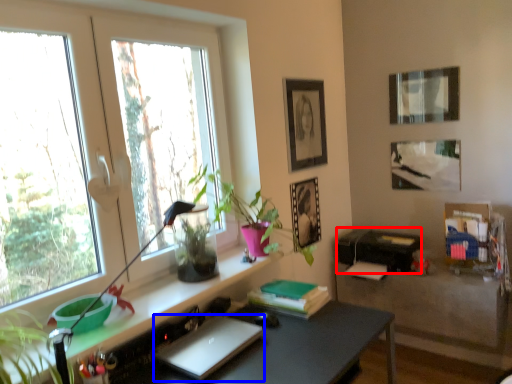
Question: Which of the following is the closest to the observer, printer (highlighted by a red box) or laptop (highlighted by a blue box)?

Choices:
 (A) printer
 (B) laptop

Answer: (B)